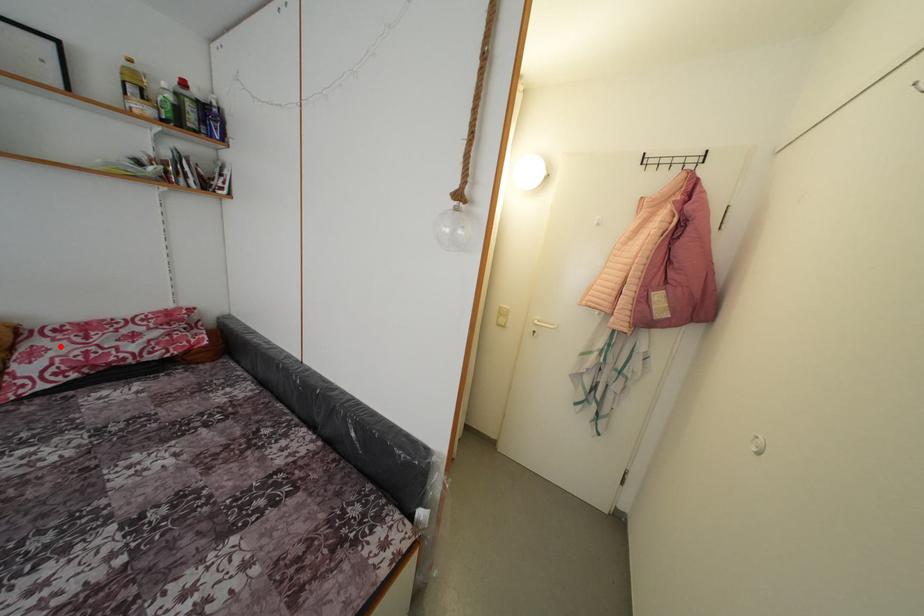
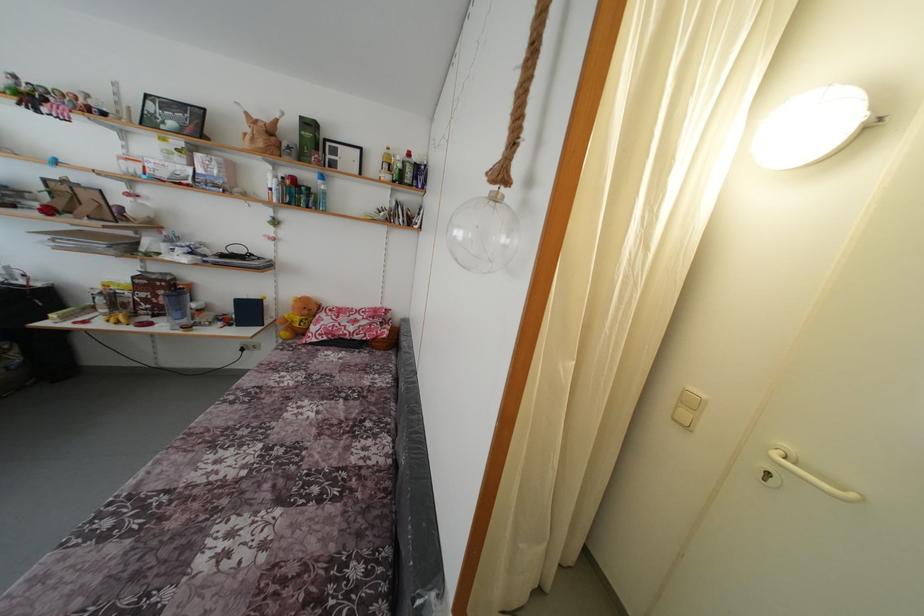
Find the pixel in the second image that matches the highlighted location in the first image.

(332, 321)